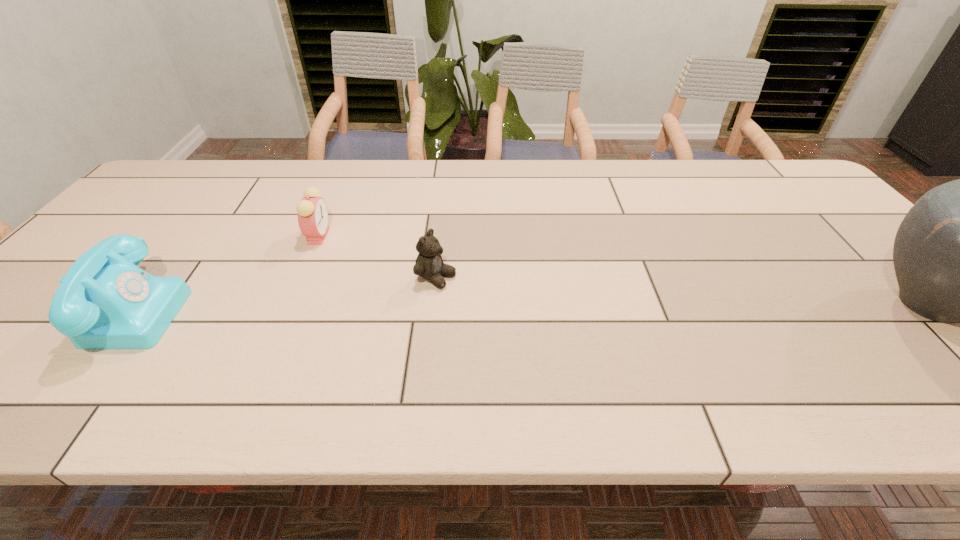
In order to click on vacant space located on the face of the second object from right to left in this screenshot , I will do `click(516, 309)`.

The image size is (960, 540). In order to click on vacant space positioned 0.370m on the face of the second object from right to left in this screenshot , I will do `click(599, 343)`.

In order to click on object that is at the near edge in this screenshot , I will do coord(105,301).

Locate an element on the screen. This screenshot has width=960, height=540. object present at the left edge is located at coordinates tap(105, 301).

Image resolution: width=960 pixels, height=540 pixels. I want to click on object positioned at the near left corner, so click(105, 301).

The image size is (960, 540). Identify the location of vacant region at the far edge. (284, 178).

You are a GUI agent. You are given a task and a screenshot of the screen. Output one action in this format:
    pyautogui.click(x=<x>, y=<y>)
    Task: Click on the vacant area at the near edge of the desktop
    
    Given the screenshot: What is the action you would take?
    pyautogui.click(x=642, y=357)

What are the coordinates of `vacant space at the left edge of the desktop` in the screenshot? It's located at (31, 309).

Locate an element on the screen. Image resolution: width=960 pixels, height=540 pixels. vacant space at the far right corner is located at coordinates (780, 177).

You are a GUI agent. You are given a task and a screenshot of the screen. Output one action in this format:
    pyautogui.click(x=<x>, y=<y>)
    Task: Click on the free point between the teddy bear and the farthest object
    The image size is (960, 540).
    Given the screenshot: What is the action you would take?
    pyautogui.click(x=376, y=256)